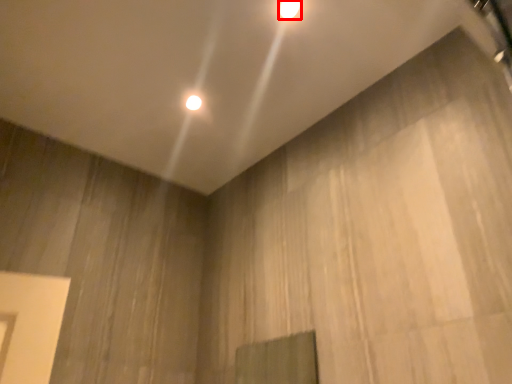
Question: From the image's perspective, considering the relative positions of lamp (annotated by the red box) and lamp in the image provided, where is lamp (annotated by the red box) located with respect to the staircase?

Choices:
 (A) above
 (B) below

Answer: (A)